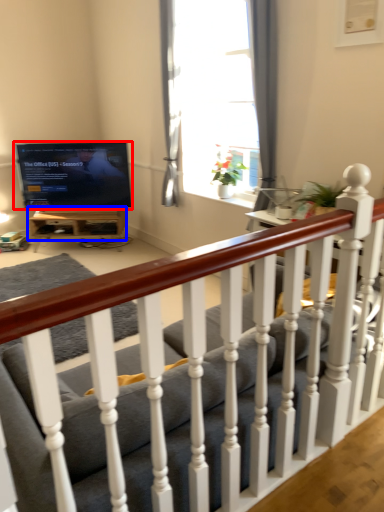
Question: Which of the following is the closest to the observer, television (highlighted by a red box) or table (highlighted by a blue box)?

Choices:
 (A) television
 (B) table

Answer: (A)